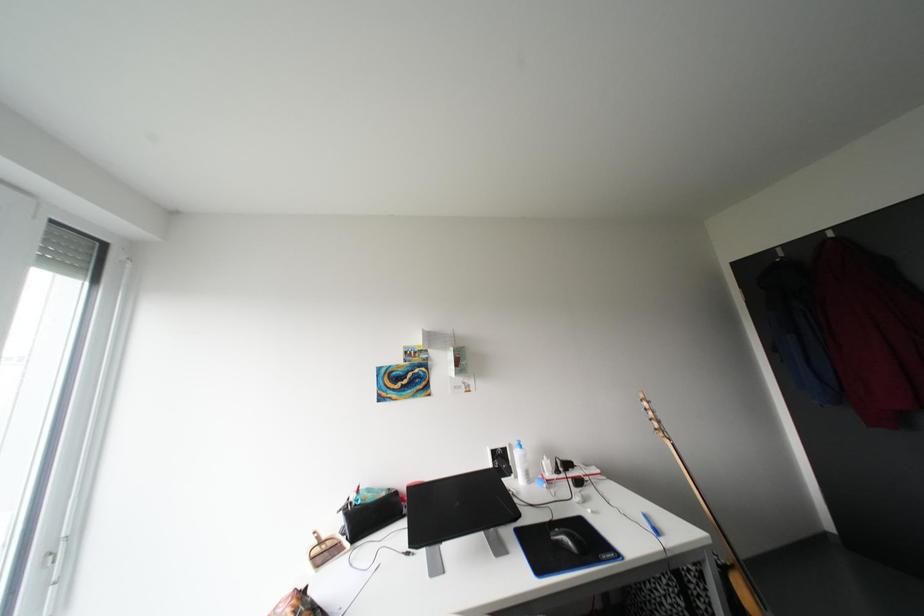
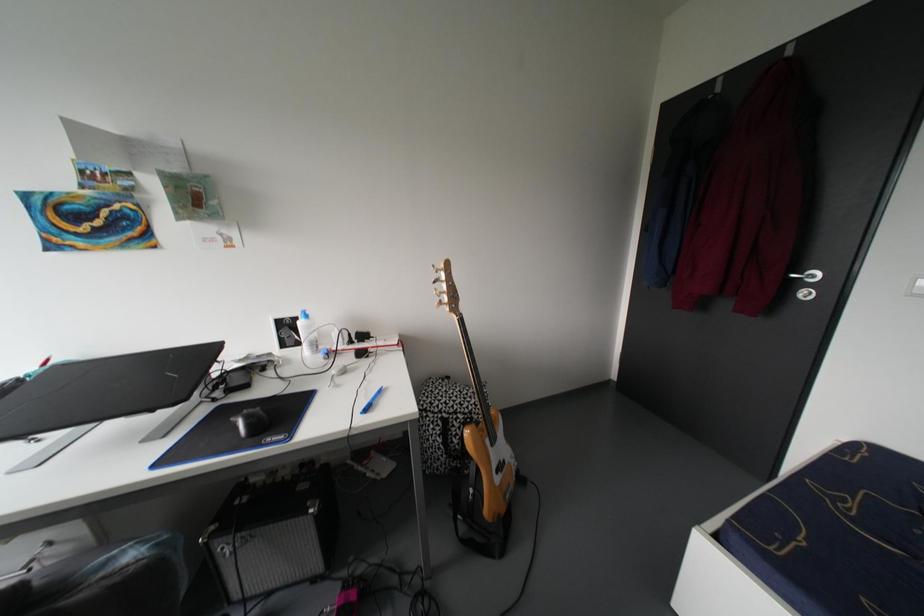
Question: Based on the continuous images, in which direction is the camera rotating? Reply with the corresponding letter.

Choices:
 (A) Left
 (B) Right
 (C) Up
 (D) Down

Answer: (D)